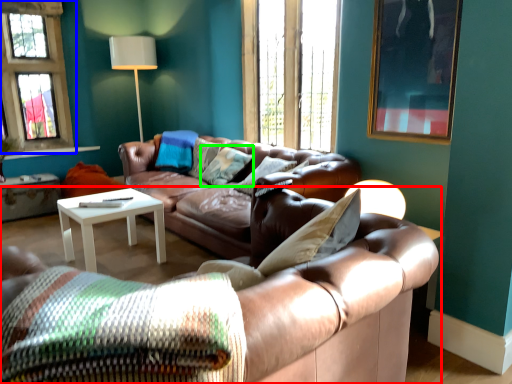
Question: Which object is the closest to the studio couch (highlighted by a red box)? Choose among these: window (highlighted by a blue box) or pillow (highlighted by a green box).

Choices:
 (A) window
 (B) pillow

Answer: (B)